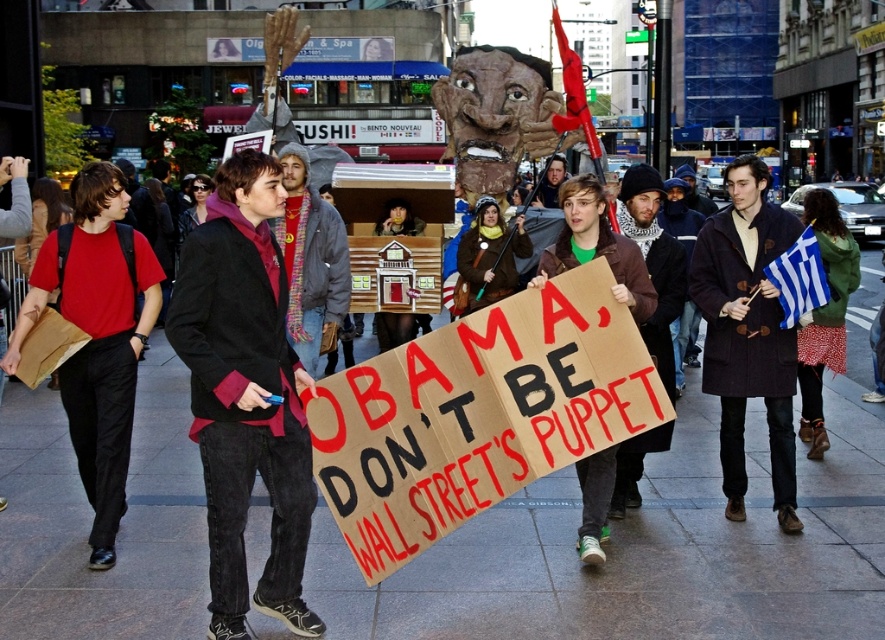
Is point (763, 349) more distant than point (680, 288)?

No.

Who is more forward, (760, 396) or (676, 305)?

Point (760, 396)

Does point (732, 481) lie behind point (644, 164)?

No, (732, 481) is in front of (644, 164).

Image resolution: width=885 pixels, height=640 pixels. Identify the location of dark brown wool coat at center. (747, 332).

Does cardboard sign at center have a lesser width compared to dark brown leather jacket at center?

In fact, cardboard sign at center might be wider than dark brown leather jacket at center.

Is cardboard sign at center taller than dark brown leather jacket at center?

No.

In order to click on cardboard sign at center in this screenshot , I will do `click(596, 246)`.

The image size is (885, 640). Identify the location of cardboard sign at center. (596, 246).

This screenshot has height=640, width=885. In order to click on dark red fabric jacket at center in this screenshot , I will do `click(245, 394)`.

Who is more forward, (293, 480) or (558, 177)?

Point (293, 480) is in front.

What do you see at coordinates (245, 394) in the screenshot? Image resolution: width=885 pixels, height=640 pixels. I see `dark red fabric jacket at center` at bounding box center [245, 394].

Identify the location of dark red fabric jacket at center. Image resolution: width=885 pixels, height=640 pixels. (245, 394).